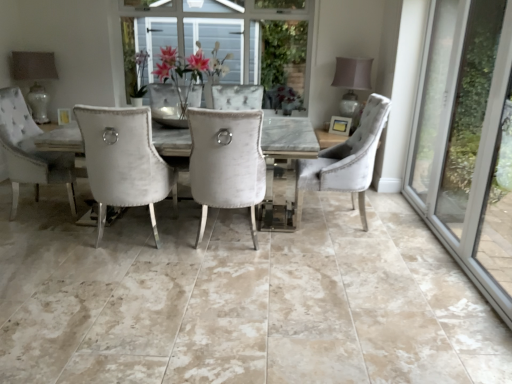
Locate an element on the screen. free space to the right of velvet white chair at center, which ranks as the first chair in left-to-right order is located at coordinates (293, 245).